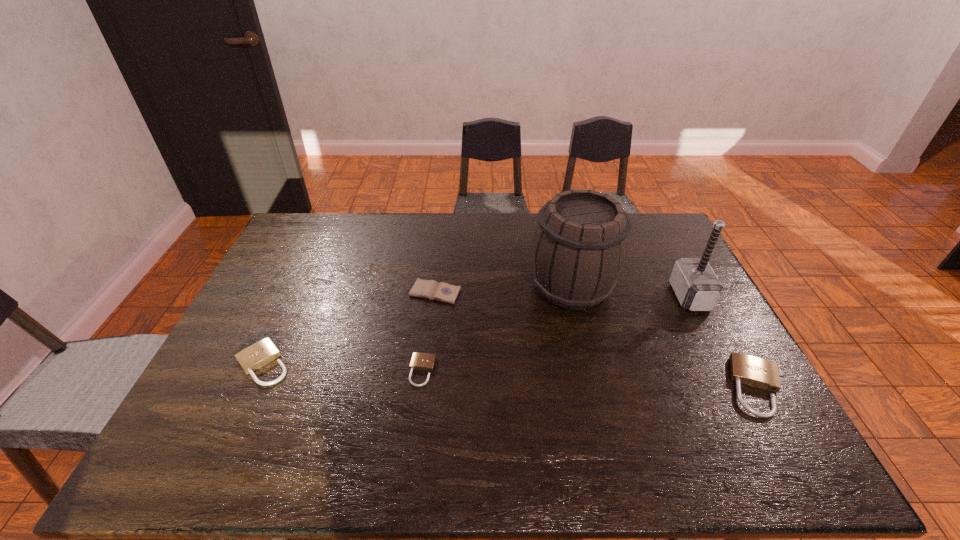
The image size is (960, 540). In the image, there is a desktop. In order to click on vacant space at the far edge in this screenshot , I will do `click(359, 248)`.

Find the location of a particular element. The image size is (960, 540). vacant position at the near edge of the desktop is located at coordinates (531, 415).

In the image, there is a desktop. What are the coordinates of `vacant region at the right edge` in the screenshot? It's located at (640, 264).

In the image, there is a desktop. Where is `vacant space at the near left corner`? This screenshot has height=540, width=960. vacant space at the near left corner is located at coordinates click(214, 401).

At what (x,y) coordinates should I click in order to perform the action: click on free point between the hammer and the second padlock from right to left. Please return your answer as a coordinate pair (x, y). Looking at the image, I should click on (556, 334).

The width and height of the screenshot is (960, 540). I want to click on empty location between the hammer and the second tallest padlock, so click(476, 330).

At what (x,y) coordinates should I click in order to perform the action: click on vacant area that lies between the second tallest padlock and the second padlock from right to left. Please return your answer as a coordinate pair (x, y). Looking at the image, I should click on (343, 368).

What are the coordinates of `vacant space in between the hammer and the second padlock from left to right` in the screenshot? It's located at (556, 334).

At what (x,y) coordinates should I click in order to perform the action: click on free space between the rightmost padlock and the hammer. Please return your answer as a coordinate pair (x, y). The width and height of the screenshot is (960, 540). Looking at the image, I should click on (723, 341).

Find the location of a particular element. This screenshot has width=960, height=540. vacant region between the rightmost padlock and the diary is located at coordinates (595, 340).